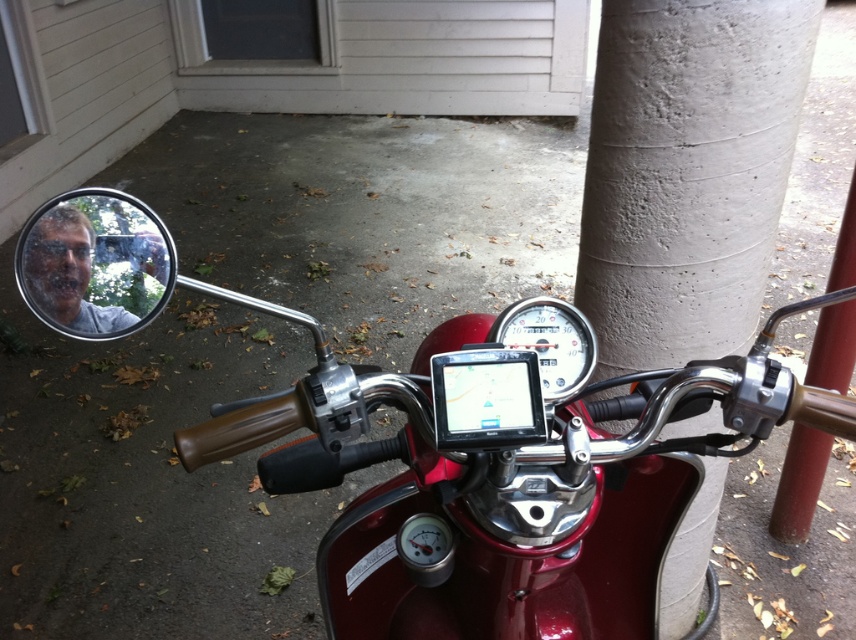
Question: Considering the relative positions of glossy red motorcycle at center and clear glass mirror at upper left in the image provided, where is glossy red motorcycle at center located with respect to clear glass mirror at upper left?

Choices:
 (A) right
 (B) left

Answer: (A)

Question: Which object appears closest to the camera in this image?

Choices:
 (A) red metal pole at right
 (B) clear glass mirror at upper left
 (C) glossy red motorcycle at center

Answer: (B)

Question: Which is farther from the clear glass mirror at upper left?

Choices:
 (A) red metal pole at right
 (B) concrete at center
 (C) glossy red motorcycle at center

Answer: (A)

Question: Can you confirm if glossy red motorcycle at center is positioned above red metal pole at right?

Choices:
 (A) yes
 (B) no

Answer: (A)

Question: Can you confirm if glossy red motorcycle at center is positioned below concrete at center?

Choices:
 (A) yes
 (B) no

Answer: (B)

Question: Which point appears closest to the camera in this image?

Choices:
 (A) (605, 60)
 (B) (825, 376)
 (C) (116, 209)

Answer: (C)